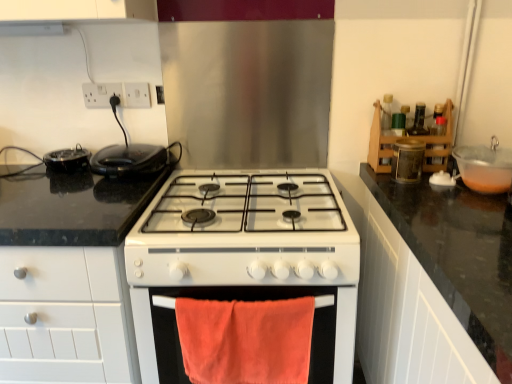
Question: Based on their positions, is white plastic socket at upper left, which appears as the 1th electric outlet when viewed from the left, located to the left or right of orange cotton towel at lower center?

Choices:
 (A) left
 (B) right

Answer: (A)

Question: In the image, is white plastic socket at upper left, which appears as the second electric outlet when viewed from the right, positioned in front of or behind orange cotton towel at lower center?

Choices:
 (A) behind
 (B) front

Answer: (A)

Question: Which is farther from the orange cotton towel at lower center?

Choices:
 (A) matte brown container at upper right
 (B) white plastic socket at upper left, which appears as the second electric outlet when viewed from the right
 (C) black granite countertop at left
 (D) wooden spice rack at upper right
 (E) black glossy waffle maker at left, which is the 1th kitchen appliance in right-to-left order

Answer: (B)

Question: Estimate the real-world distances between objects in this image. Which object is farther from the white glossy gas stove at center?

Choices:
 (A) black granite countertop at left
 (B) white plastic socket at upper left, which appears as the 1th electric outlet when viewed from the left
 (C) matte brown container at upper right
 (D) white glossy exhaust hood at upper center
 (E) wooden spice rack at upper right

Answer: (D)